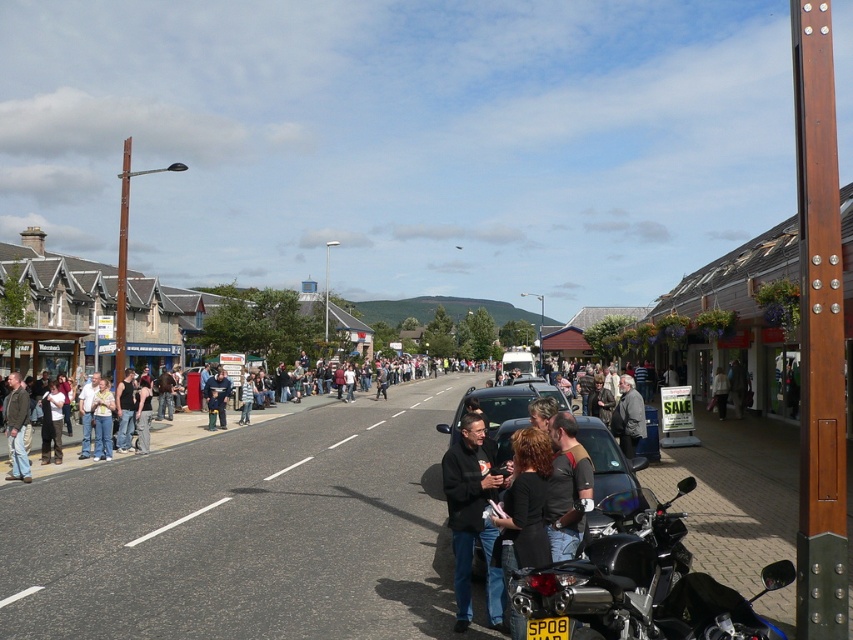
How much distance is there between black glossy car at center and light brown leather jacket at center?

11.68 meters

Which is behind, point (595, 435) or point (711, 394)?

The point (711, 394) is behind.

Between point (506, 400) and point (718, 376), which one is positioned behind?

Point (718, 376)

Locate an element on the screen. The image size is (853, 640). black glossy car at center is located at coordinates (502, 413).

Which is behind, point (460, 566) or point (718, 416)?

Point (718, 416)

The height and width of the screenshot is (640, 853). What do you see at coordinates (471, 518) in the screenshot? I see `black matte jacket at center` at bounding box center [471, 518].

Find the location of `black matte jacket at center`. black matte jacket at center is located at coordinates (471, 518).

Identify the location of dark gray jacket at center. (628, 417).

From the picture: Can you confirm if dark gray jacket at center is bigger than light brown leather jacket at center?

Indeed, dark gray jacket at center has a larger size compared to light brown leather jacket at center.

Image resolution: width=853 pixels, height=640 pixels. What are the coordinates of `dark gray jacket at center` in the screenshot? It's located at click(x=628, y=417).

The image size is (853, 640). I want to click on dark gray jacket at center, so click(628, 417).